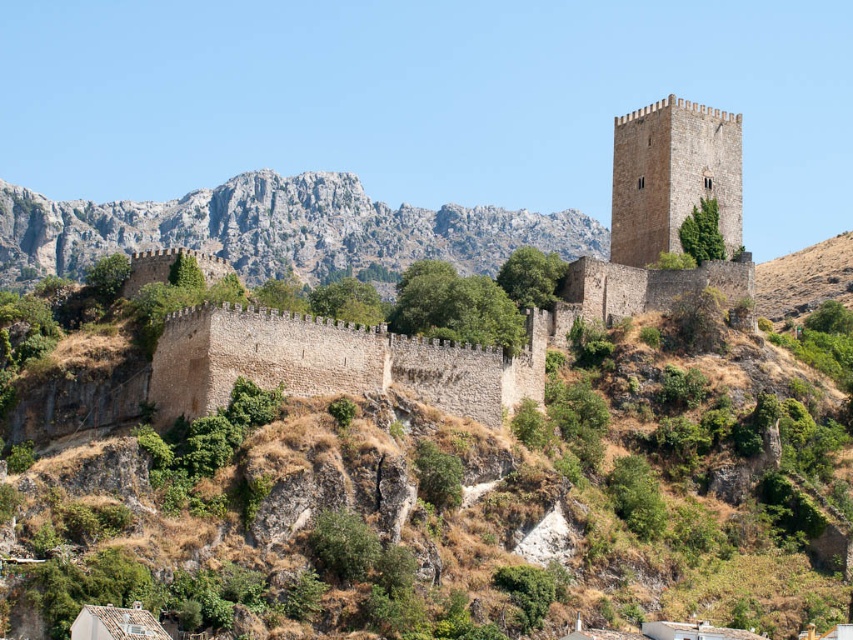
Question: Is rugged stone mountain at upper center thinner than brown stone tower at upper center?

Choices:
 (A) yes
 (B) no

Answer: (B)

Question: Does rugged stone mountain at upper center have a lesser width compared to brown stone tower at upper center?

Choices:
 (A) yes
 (B) no

Answer: (B)

Question: Among these points, which one is nearest to the camera?

Choices:
 (A) (590, 243)
 (B) (734, 234)

Answer: (B)

Question: Does rugged stone mountain at upper center have a lesser width compared to brown stone tower at upper center?

Choices:
 (A) yes
 (B) no

Answer: (B)

Question: Which of the following is the farthest from the observer?

Choices:
 (A) rugged stone mountain at upper center
 (B) brown stone tower at upper center

Answer: (A)

Question: Among these points, which one is nearest to the camera?

Choices:
 (A) (741, 179)
 (B) (0, 275)

Answer: (A)